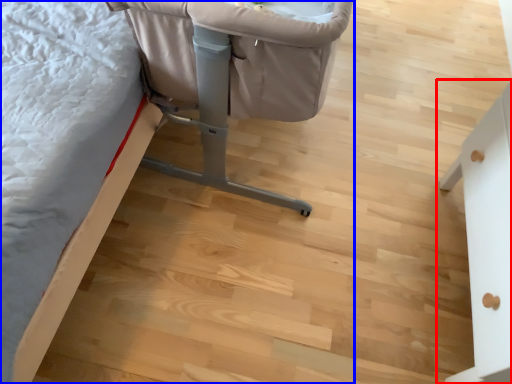
Question: Which point is further to the camera, furniture (highlighted by a red box) or furniture (highlighted by a blue box)?

Choices:
 (A) furniture
 (B) furniture

Answer: (B)